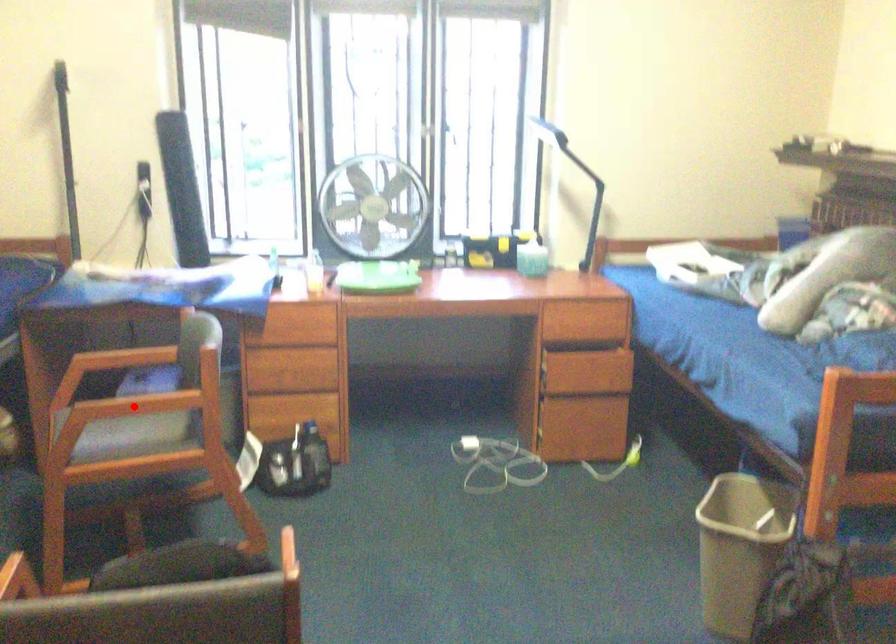
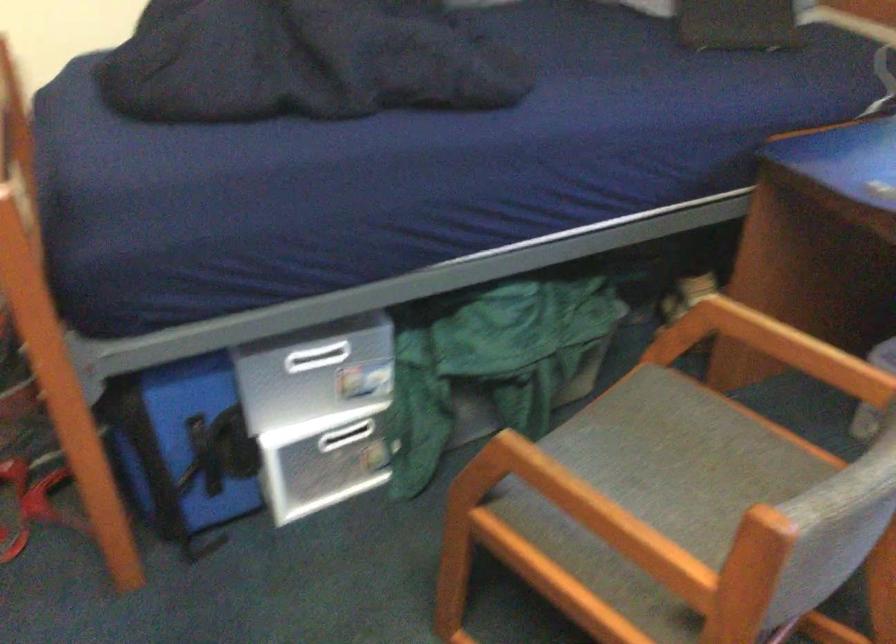
Find the pixel in the second image that matches the highlighted location in the first image.

(597, 514)